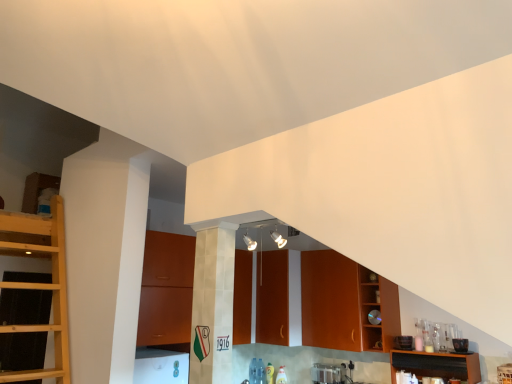
Question: Does satin silver toaster at lower center have a larger size compared to matte wood cabinetry at center, positioned as the first cabinetry in left-to-right order?

Choices:
 (A) yes
 (B) no

Answer: (B)

Question: Can you confirm if satin silver toaster at lower center is positioned to the left of matte wood cabinetry at center, positioned as the first cabinetry in left-to-right order?

Choices:
 (A) no
 (B) yes

Answer: (A)

Question: From the image's perspective, is satin silver toaster at lower center on matte wood cabinetry at center, which ranks as the fourth cabinetry in right-to-left order?

Choices:
 (A) no
 (B) yes

Answer: (A)

Question: Is satin silver toaster at lower center completely or partially outside of matte wood cabinetry at center, which ranks as the fourth cabinetry in right-to-left order?

Choices:
 (A) yes
 (B) no

Answer: (A)

Question: Is satin silver toaster at lower center thinner than matte wood cabinetry at center, positioned as the first cabinetry in left-to-right order?

Choices:
 (A) no
 (B) yes

Answer: (B)

Question: In terms of width, does brown wood cabinet at center, which is counted as the second cabinetry, starting from the right, look wider or thinner when compared to matte wood cabinetry at center, which ranks as the fourth cabinetry in right-to-left order?

Choices:
 (A) thin
 (B) wide

Answer: (A)

Question: Considering the positions of brown wood cabinet at center, marked as the 3th cabinetry in a left-to-right arrangement, and matte wood cabinetry at center, positioned as the first cabinetry in left-to-right order, in the image, is brown wood cabinet at center, marked as the 3th cabinetry in a left-to-right arrangement, bigger or smaller than matte wood cabinetry at center, positioned as the first cabinetry in left-to-right order,?

Choices:
 (A) small
 (B) big

Answer: (A)

Question: From a real-world perspective, relative to matte wood cabinetry at center, positioned as the first cabinetry in left-to-right order, is brown wood cabinet at center, marked as the 3th cabinetry in a left-to-right arrangement, vertically above or below?

Choices:
 (A) above
 (B) below

Answer: (B)

Question: Choose the correct answer: Is brown wood cabinet at center, marked as the 3th cabinetry in a left-to-right arrangement, inside matte wood cabinetry at center, which ranks as the fourth cabinetry in right-to-left order, or outside it?

Choices:
 (A) outside
 (B) inside

Answer: (A)

Question: Considering the relative positions of satin silver toaster at lower center and brown wood cabinet at center, marked as the 3th cabinetry in a left-to-right arrangement, in the image provided, is satin silver toaster at lower center to the left or to the right of brown wood cabinet at center, marked as the 3th cabinetry in a left-to-right arrangement,?

Choices:
 (A) right
 (B) left

Answer: (B)

Question: Is point (330, 370) positioned closer to the camera than point (315, 296)?

Choices:
 (A) closer
 (B) farther

Answer: (A)

Question: Is satin silver toaster at lower center in front of or behind brown wood cabinet at center, marked as the 3th cabinetry in a left-to-right arrangement, in the image?

Choices:
 (A) behind
 (B) front

Answer: (A)

Question: Is satin silver toaster at lower center bigger or smaller than brown wood cabinet at center, which is counted as the second cabinetry, starting from the right?

Choices:
 (A) big
 (B) small

Answer: (B)

Question: Looking at their shapes, would you say matte wood cabinetry at center, which ranks as the fourth cabinetry in right-to-left order, is wider or thinner than wooden cabinet at right, the 4th cabinetry positioned from the left?

Choices:
 (A) thin
 (B) wide

Answer: (B)

Question: From a real-world perspective, is matte wood cabinetry at center, which ranks as the fourth cabinetry in right-to-left order, positioned above or below wooden cabinet at right, the 4th cabinetry positioned from the left?

Choices:
 (A) below
 (B) above

Answer: (B)